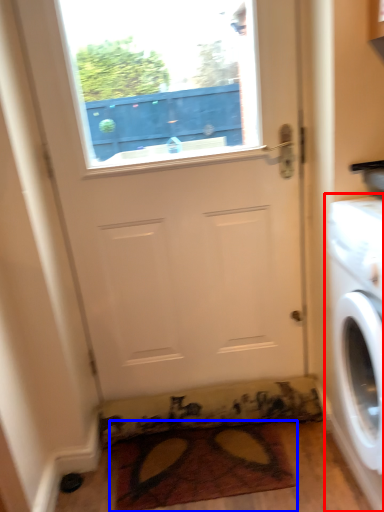
Question: Which object appears closest to the camera in this image, washing machine (highlighted by a red box) or doormat (highlighted by a blue box)?

Choices:
 (A) washing machine
 (B) doormat

Answer: (A)